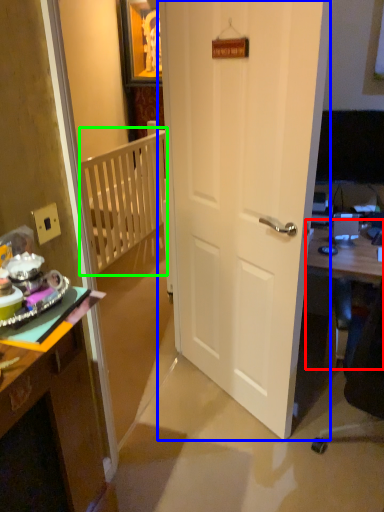
Question: Which is farther away from table (highlighted by a red box)? door (highlighted by a blue box) or balustrade (highlighted by a green box)?

Choices:
 (A) door
 (B) balustrade

Answer: (B)